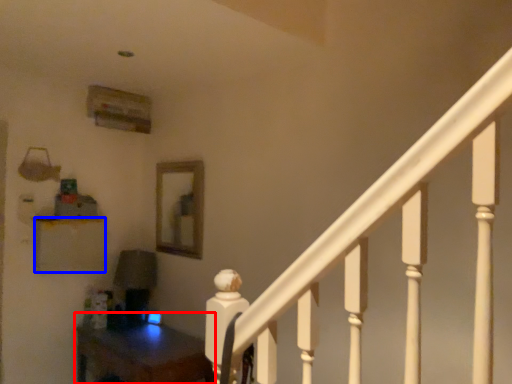
Question: Among these objects, which one is farthest to the camera, table (highlighted by a red box) or furniture (highlighted by a blue box)?

Choices:
 (A) table
 (B) furniture

Answer: (B)